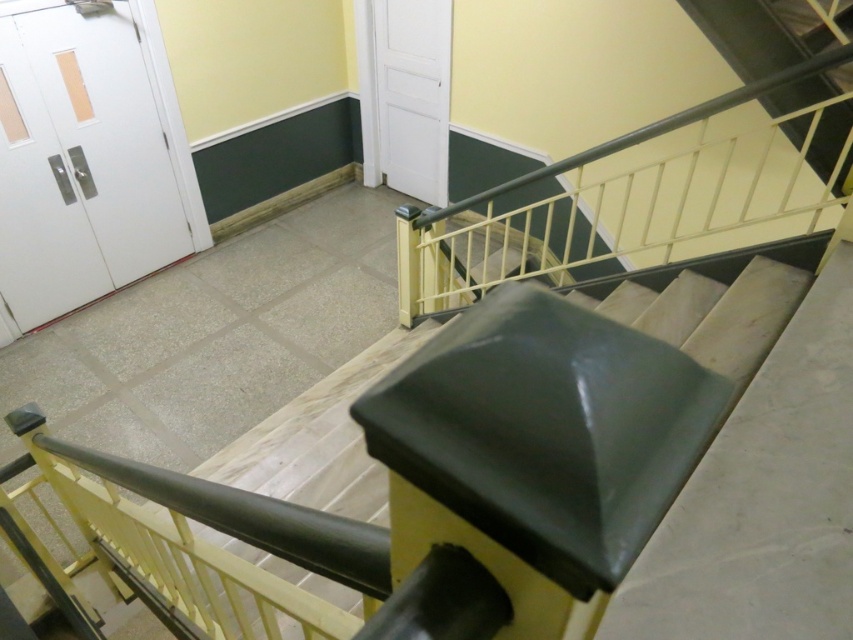
You are a delivery person carrying a large box that is 1 meter wide. You need to move through the white matte door at left and the white matte door at upper center. Which door should you choose to ensure the box fits through?

The white matte door at left might be wider than white matte door at upper center, so you should choose the white matte door at left to ensure the box fits through.